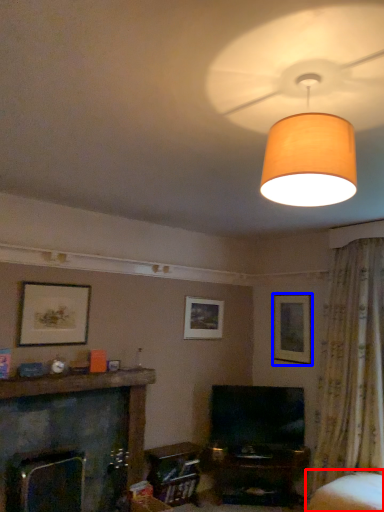
Question: Which of the following is the closest to the observer, swivel chair (highlighted by a red box) or picture frame (highlighted by a blue box)?

Choices:
 (A) swivel chair
 (B) picture frame

Answer: (A)